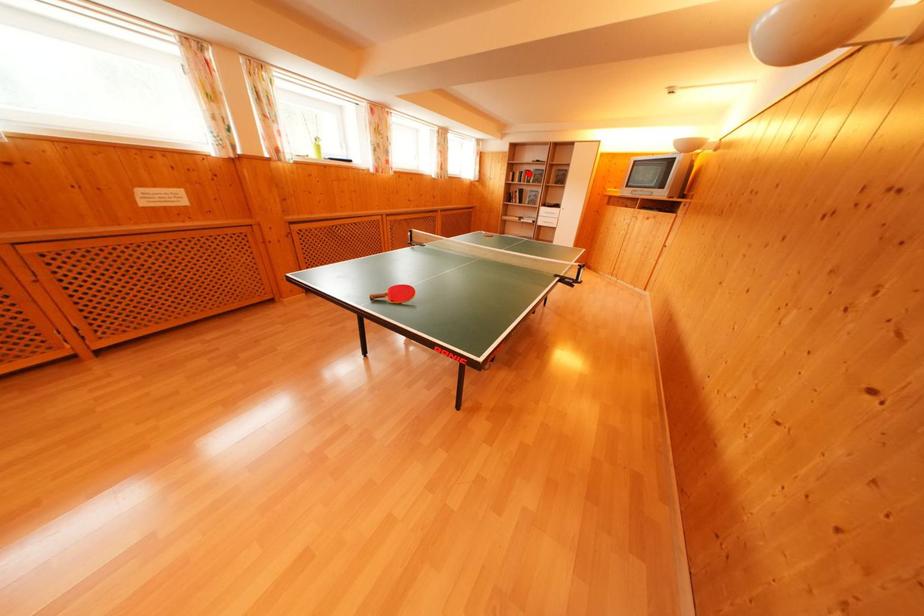
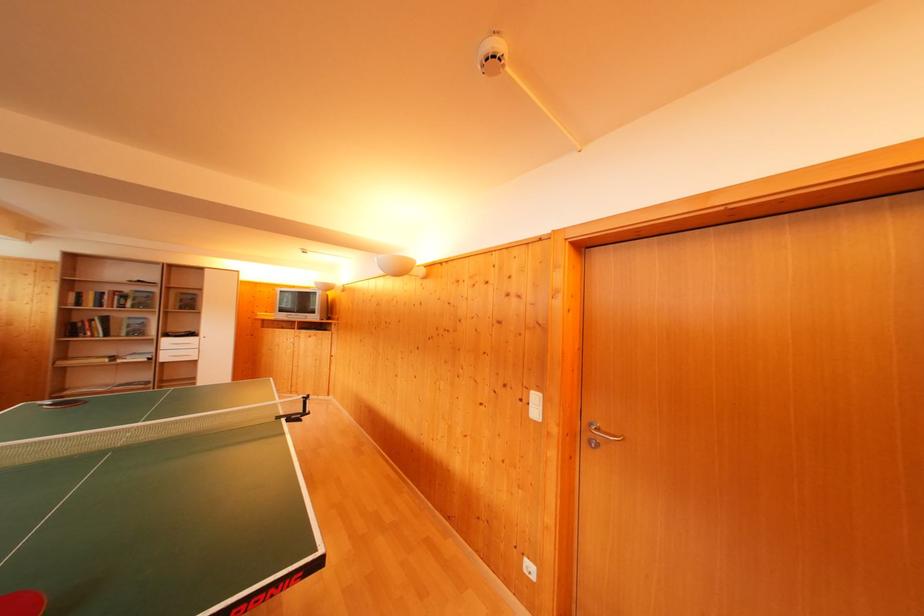
Question: A red point is marked in image1. In image2, is the corresponding 3D point closer to the camera or farther? Reply with the corresponding letter.

Choices:
 (A) The corresponding 3D point is closer.
 (B) The corresponding 3D point is farther.

Answer: (B)